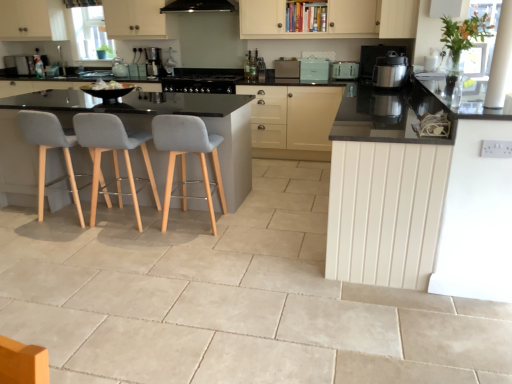
The height and width of the screenshot is (384, 512). What are the coordinates of `matte black cabinet at center, the second cabinetry viewed from the front` in the screenshot? It's located at (293, 120).

At what (x,y) coordinates should I click in order to perform the action: click on satin black coffee machine at center. Please return your answer as a coordinate pair (x, y). The height and width of the screenshot is (384, 512). Looking at the image, I should click on (154, 62).

Locate an element on the screen. This screenshot has width=512, height=384. white wood counter at right is located at coordinates (421, 199).

What do you see at coordinates (390, 70) in the screenshot?
I see `satin silver pressure cooker at right, placed as the first kitchen appliance when sorted from front to back` at bounding box center [390, 70].

The height and width of the screenshot is (384, 512). Find the location of `clear glass window screen at upper left`. clear glass window screen at upper left is located at coordinates (91, 33).

Is satin silver pressure cooker at right, the 2th kitchen appliance viewed from the top, not close to white plastic toaster at upper center, the first kitchen appliance when ordered from back to front?

No.

From the image's perspective, which is below, satin silver pressure cooker at right, the first kitchen appliance ordered from the bottom, or white plastic toaster at upper center, arranged as the second kitchen appliance when ordered from the bottom?

satin silver pressure cooker at right, the first kitchen appliance ordered from the bottom, is shown below in the image.

Considering the positions of objects satin silver pressure cooker at right, the first kitchen appliance ordered from the bottom, and white plastic toaster at upper center, the 1th kitchen appliance in the top-to-bottom sequence, in the image provided, who is more to the right, satin silver pressure cooker at right, the first kitchen appliance ordered from the bottom, or white plastic toaster at upper center, the 1th kitchen appliance in the top-to-bottom sequence,?

satin silver pressure cooker at right, the first kitchen appliance ordered from the bottom.

From a real-world perspective, who is located higher, satin silver pressure cooker at right, which is the second kitchen appliance in back-to-front order, or white plastic toaster at upper center, arranged as the second kitchen appliance when ordered from the bottom?

satin silver pressure cooker at right, which is the second kitchen appliance in back-to-front order.

Is light gray fabric chair at left, which appears as the 2th chair when viewed from the left, located outside satin black coffee machine at center?

Yes, light gray fabric chair at left, which appears as the 2th chair when viewed from the left, is located beyond the bounds of satin black coffee machine at center.

Can you confirm if light gray fabric chair at left, which appears as the 2th chair when viewed from the left, is positioned to the left of satin black coffee machine at center?

In fact, light gray fabric chair at left, which appears as the 2th chair when viewed from the left, is to the right of satin black coffee machine at center.

Is light gray fabric chair at left, the 2th chair viewed from the right, taller or shorter than satin black coffee machine at center?

In the image, light gray fabric chair at left, the 2th chair viewed from the right, appears to be taller than satin black coffee machine at center.

Which is behind, point (87, 29) or point (350, 77)?

Positioned behind is point (87, 29).

Which of these two, clear glass window screen at upper left or white plastic toaster at upper center, the 1th kitchen appliance in the top-to-bottom sequence, is smaller?

white plastic toaster at upper center, the 1th kitchen appliance in the top-to-bottom sequence, is smaller.

Is clear glass window screen at upper left directly adjacent to white plastic toaster at upper center, the first kitchen appliance when ordered from back to front?

No, clear glass window screen at upper left is not beside white plastic toaster at upper center, the first kitchen appliance when ordered from back to front.

Considering the sizes of objects clear glass window screen at upper left and white plastic toaster at upper center, which is the second kitchen appliance in front-to-back order, in the image provided, who is taller, clear glass window screen at upper left or white plastic toaster at upper center, which is the second kitchen appliance in front-to-back order,?

clear glass window screen at upper left is taller.

Could you tell me if black glass stove at center, the first appliance viewed from the left, is turned towards white plastic toaster at upper center, which is the second kitchen appliance in front-to-back order?

No.

Is black glass stove at center, the first appliance viewed from the left, positioned beyond the bounds of white plastic toaster at upper center, which is the second kitchen appliance in front-to-back order?

Indeed, black glass stove at center, the first appliance viewed from the left, is completely outside white plastic toaster at upper center, which is the second kitchen appliance in front-to-back order.

Which of these two, black glass stove at center, the first appliance viewed from the left, or white plastic toaster at upper center, arranged as the second kitchen appliance when ordered from the bottom, stands taller?

Standing taller between the two is black glass stove at center, the first appliance viewed from the left.

Considering the points (188, 85) and (346, 65), which point is behind, point (188, 85) or point (346, 65)?

Point (188, 85)

Identify the location of the 2nd appliance to the left when counting from the matte black cabinet at center, the 1th cabinetry when ordered from back to front. (202, 80).

Looking at this image, is matte black cabinet at center, which is the first cabinetry from bottom to top, positioned with its back to black glass stove at center, placed as the third appliance when sorted from right to left?

No, black glass stove at center, placed as the third appliance when sorted from right to left, is not at the back of matte black cabinet at center, which is the first cabinetry from bottom to top.

From the image's perspective, which is above, matte black cabinet at center, the second cabinetry viewed from the front, or black glass stove at center, the first appliance viewed from the left?

black glass stove at center, the first appliance viewed from the left, appears higher in the image.

Which object is wider, matte black cabinet at center, the 1th cabinetry when ordered from back to front, or black glass stove at center, the first appliance viewed from the left?

With larger width is black glass stove at center, the first appliance viewed from the left.

Which object is positioned more to the right, white wood counter at right or grey fabric chair at left, placed as the 1th chair when sorted from left to right?

From the viewer's perspective, white wood counter at right appears more on the right side.

Can you confirm if white wood counter at right is thinner than grey fabric chair at left, placed as the 1th chair when sorted from left to right?

Incorrect, the width of white wood counter at right is not less than that of grey fabric chair at left, placed as the 1th chair when sorted from left to right.

Starting from the white wood counter at right, which chair is the 3rd one to the left? Please provide its 2D coordinates.

[(49, 148)]

Can you confirm if white wood counter at right is shorter than grey fabric chair at left, placed as the 1th chair when sorted from left to right?

In fact, white wood counter at right may be taller than grey fabric chair at left, placed as the 1th chair when sorted from left to right.

Is metallic silver toaster at upper right, the 3th appliance viewed from the left, a part of grey fabric chair at left, which is counted as the 3th chair, starting from the right?

Actually, metallic silver toaster at upper right, the 3th appliance viewed from the left, is outside grey fabric chair at left, which is counted as the 3th chair, starting from the right.

From a real-world perspective, is grey fabric chair at left, placed as the 1th chair when sorted from left to right, positioned over metallic silver toaster at upper right, the 3th appliance viewed from the left, based on gravity?

No.

Is grey fabric chair at left, which is counted as the 3th chair, starting from the right, not near metallic silver toaster at upper right, arranged as the first appliance when viewed from the right?

Yes.

In terms of height, does grey fabric chair at left, which is counted as the 3th chair, starting from the right, look taller or shorter compared to metallic silver toaster at upper right, arranged as the first appliance when viewed from the right?

grey fabric chair at left, which is counted as the 3th chair, starting from the right, is taller than metallic silver toaster at upper right, arranged as the first appliance when viewed from the right.

The image size is (512, 384). Identify the location of kitchen appliance that appears above the white plastic toaster at upper center, arranged as the second kitchen appliance when ordered from the bottom (from a real-world perspective). (390, 70).

From the image's perspective, count 2nd chairs downward from the satin black coffee machine at center and point to it. Please provide its 2D coordinates.

[(113, 153)]

Estimate the real-world distances between objects in this image. Which object is closer to black matte exhaust hood at upper center, matte teal toaster at center, which appears as the 2th appliance when viewed from the right, or white wood counter at right?

matte teal toaster at center, which appears as the 2th appliance when viewed from the right, is closer to black matte exhaust hood at upper center.

Looking at the image, which one is located closer to matte white cabinet at upper right, which is counted as the 2th cabinetry, starting from the back, satin black coffee machine at center or light gray fabric chair at left, the 2th chair viewed from the right?

Among the two, light gray fabric chair at left, the 2th chair viewed from the right, is located nearer to matte white cabinet at upper right, which is counted as the 2th cabinetry, starting from the back.

Consider the image. Which object lies further to the anchor point grey fabric chair at left, placed as the 1th chair when sorted from left to right, light gray fabric chair at center, acting as the 3th chair starting from the left, or matte teal toaster at center, arranged as the second appliance when viewed from the left?

matte teal toaster at center, arranged as the second appliance when viewed from the left.

Considering their positions, is matte black cabinet at center, the 1th cabinetry when ordered from back to front, positioned further to clear glass window screen at upper left than light gray fabric chair at center, acting as the 3th chair starting from the left?

Based on the image, light gray fabric chair at center, acting as the 3th chair starting from the left, appears to be further to clear glass window screen at upper left.

Based on their spatial positions, is grey fabric chair at left, placed as the 1th chair when sorted from left to right, or black glass stove at center, the first appliance viewed from the left, closer to matte teal toaster at center, arranged as the second appliance when viewed from the left?

black glass stove at center, the first appliance viewed from the left, lies closer to matte teal toaster at center, arranged as the second appliance when viewed from the left, than the other object.

Considering their positions, is matte white cabinet at upper right, which is the 2th cabinetry from bottom to top, positioned closer to light gray fabric chair at left, the 2th chair viewed from the right, than white plastic toaster at upper center, which is the second kitchen appliance in front-to-back order?

white plastic toaster at upper center, which is the second kitchen appliance in front-to-back order, lies closer to light gray fabric chair at left, the 2th chair viewed from the right, than the other object.

From the image, which object appears to be nearer to grey fabric chair at left, which is counted as the 3th chair, starting from the right, light gray fabric chair at left, the 2th chair viewed from the right, or matte black cabinet at center, which is the first cabinetry from bottom to top?

light gray fabric chair at left, the 2th chair viewed from the right, is closer to grey fabric chair at left, which is counted as the 3th chair, starting from the right.

From the image, which object appears to be nearer to matte teal toaster at center, arranged as the second appliance when viewed from the left, metallic silver toaster at upper right, the 3th appliance viewed from the left, or light gray fabric chair at center, acting as the 3th chair starting from the left?

metallic silver toaster at upper right, the 3th appliance viewed from the left, lies closer to matte teal toaster at center, arranged as the second appliance when viewed from the left, than the other object.

Find the location of a particular element. exhaust hood between light gray fabric chair at left, the 2th chair viewed from the right, and black glass stove at center, placed as the third appliance when sorted from right to left, in the front-back direction is located at coordinates (200, 6).

This screenshot has width=512, height=384. I want to click on coffee machine situated between grey fabric chair at left, placed as the 1th chair when sorted from left to right, and satin silver pressure cooker at right, which is the second kitchen appliance in back-to-front order, from left to right, so click(154, 62).

Find the location of a particular element. The height and width of the screenshot is (384, 512). exhaust hood located between white wood counter at right and black glass stove at center, placed as the third appliance when sorted from right to left, in the depth direction is located at coordinates (200, 6).

Where is `coffee machine located between grey fabric chair at left, which is counted as the 3th chair, starting from the right, and metallic silver toaster at upper right, arranged as the first appliance when viewed from the right, in the left-right direction`? coffee machine located between grey fabric chair at left, which is counted as the 3th chair, starting from the right, and metallic silver toaster at upper right, arranged as the first appliance when viewed from the right, in the left-right direction is located at coordinates (154, 62).